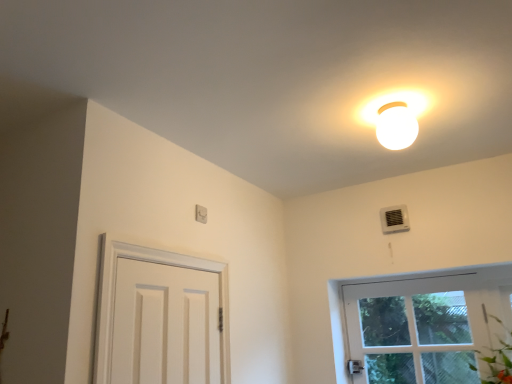
What do you see at coordinates (394, 219) in the screenshot? The height and width of the screenshot is (384, 512). I see `white plastic air conditioner at upper right` at bounding box center [394, 219].

Find the location of a particular element. The height and width of the screenshot is (384, 512). white plastic air conditioner at upper right is located at coordinates (394, 219).

Where is `white plastic light switch at upper center`? Image resolution: width=512 pixels, height=384 pixels. white plastic light switch at upper center is located at coordinates (201, 214).

Based on the photo, can white plastic light switch at upper center be found inside white glossy light fixture at upper center?

Definitely not — white plastic light switch at upper center is not inside white glossy light fixture at upper center.

Between white glossy light fixture at upper center and white plastic light switch at upper center, which one has more height?

white glossy light fixture at upper center is taller.

Locate an element on the screen. The image size is (512, 384). light switch on the left of the white glossy light fixture at upper center is located at coordinates (201, 214).

Can you tell me how much white glossy light fixture at upper center and white plastic light switch at upper center differ in facing direction?

They differ by 91.7 degrees in their facing directions.

Is white plastic light switch at upper center at the right side of white glossy light fixture at upper center?

In fact, white plastic light switch at upper center is to the left of white glossy light fixture at upper center.

Between point (200, 208) and point (391, 110), which one is positioned in front?

Point (391, 110)

Based on the photo, is white plastic light switch at upper center smaller than white glossy light fixture at upper center?

Yes, white plastic light switch at upper center is smaller than white glossy light fixture at upper center.

From the image's perspective, is white plastic light switch at upper center on top of white glossy light fixture at upper center?

No, from the image's perspective, white plastic light switch at upper center is not above white glossy light fixture at upper center.

Considering the positions of objects white plastic air conditioner at upper right and white plastic light switch at upper center in the image provided, who is in front, white plastic air conditioner at upper right or white plastic light switch at upper center?

white plastic light switch at upper center.

From the image's perspective, who appears lower, white plastic air conditioner at upper right or white plastic light switch at upper center?

white plastic air conditioner at upper right, from the image's perspective.

What's the angular difference between white plastic air conditioner at upper right and white plastic light switch at upper center's facing directions?

The angular difference between white plastic air conditioner at upper right and white plastic light switch at upper center is 93.2 degrees.

Does white plastic air conditioner at upper right have a larger size compared to white plastic light switch at upper center?

A: Correct, white plastic air conditioner at upper right is larger in size than white plastic light switch at upper center.

Considering the relative sizes of white plastic air conditioner at upper right and white glossy light fixture at upper center in the image provided, is white plastic air conditioner at upper right shorter than white glossy light fixture at upper center?

Correct, white plastic air conditioner at upper right is not as tall as white glossy light fixture at upper center.

From the image's perspective, would you say white plastic air conditioner at upper right is positioned over white glossy light fixture at upper center?

No, from the image's perspective, white plastic air conditioner at upper right is not above white glossy light fixture at upper center.

Is white plastic air conditioner at upper right positioned with its back to white glossy light fixture at upper center?

white plastic air conditioner at upper right is not turned away from white glossy light fixture at upper center.

How many degrees apart are the facing directions of white plastic air conditioner at upper right and white glossy light fixture at upper center?

They differ by 1.52 degrees in their facing directions.

Would you say white glossy light fixture at upper center contains white plastic air conditioner at upper right?

No.

Locate an element on the screen. The image size is (512, 384). air conditioner below the white glossy light fixture at upper center (from a real-world perspective) is located at coordinates [x=394, y=219].

In the scene shown: Which object is further away from the camera, white glossy light fixture at upper center or white plastic air conditioner at upper right?

white plastic air conditioner at upper right is more distant.

Is point (408, 120) less distant than point (397, 214)?

Yes, it is in front of point (397, 214).

Is white plastic light switch at upper center to the right of white plastic air conditioner at upper right from the viewer's perspective?

No, white plastic light switch at upper center is not to the right of white plastic air conditioner at upper right.

From the image's perspective, is white plastic light switch at upper center located above white plastic air conditioner at upper right?

Yes.

Between white plastic light switch at upper center and white plastic air conditioner at upper right, which one is positioned in front?

white plastic light switch at upper center is closer to the camera.

From a real-world perspective, between white plastic light switch at upper center and white plastic air conditioner at upper right, who is vertically higher?

From a 3D spatial view, white plastic air conditioner at upper right is above.

Locate an element on the screen. lamp above the white plastic light switch at upper center (from the image's perspective) is located at coordinates (396, 126).

Find the location of a particular element. The image size is (512, 384). lamp that appears above the white plastic light switch at upper center (from a real-world perspective) is located at coordinates (396, 126).

Based on their spatial positions, is white plastic light switch at upper center or white glossy light fixture at upper center further from white plastic air conditioner at upper right?

white plastic light switch at upper center lies further to white plastic air conditioner at upper right than the other object.

From the picture: Looking at the image, which one is located closer to white plastic air conditioner at upper right, white glossy light fixture at upper center or white plastic light switch at upper center?

Among the two, white glossy light fixture at upper center is located nearer to white plastic air conditioner at upper right.

When comparing their distances from white plastic light switch at upper center, does white glossy light fixture at upper center or white plastic air conditioner at upper right seem closer?

white glossy light fixture at upper center is positioned closer to the anchor white plastic light switch at upper center.

From the image, which object appears to be farther from white glossy light fixture at upper center, white plastic light switch at upper center or white plastic air conditioner at upper right?

Based on the image, white plastic light switch at upper center appears to be further to white glossy light fixture at upper center.

From the image, which object appears to be nearer to white plastic light switch at upper center, white plastic air conditioner at upper right or white glossy light fixture at upper center?

white glossy light fixture at upper center.

Based on the photo, based on their spatial positions, is white plastic air conditioner at upper right or white plastic light switch at upper center further from white glossy light fixture at upper center?

Based on the image, white plastic light switch at upper center appears to be further to white glossy light fixture at upper center.

Find the location of a particular element. lamp situated between white plastic light switch at upper center and white plastic air conditioner at upper right from left to right is located at coordinates (396, 126).